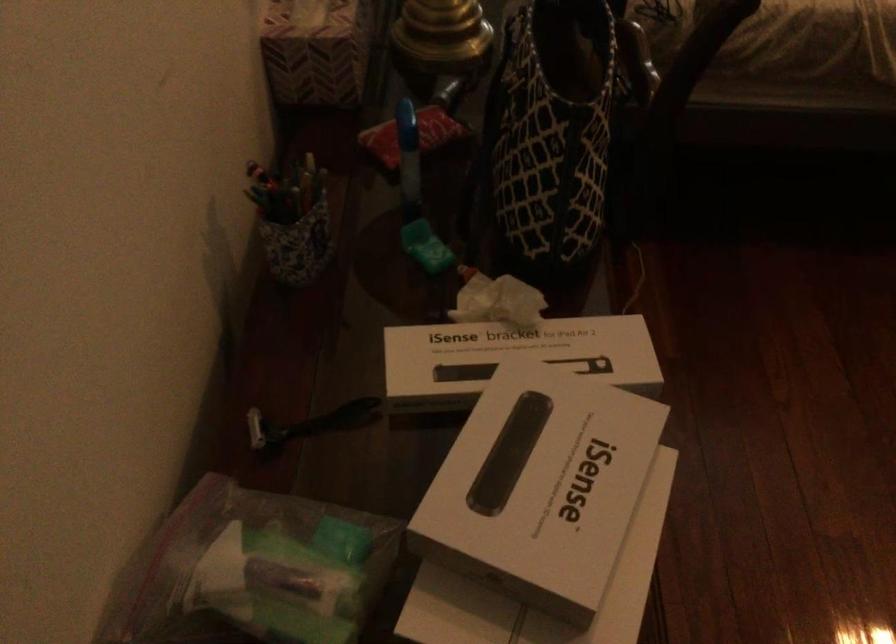
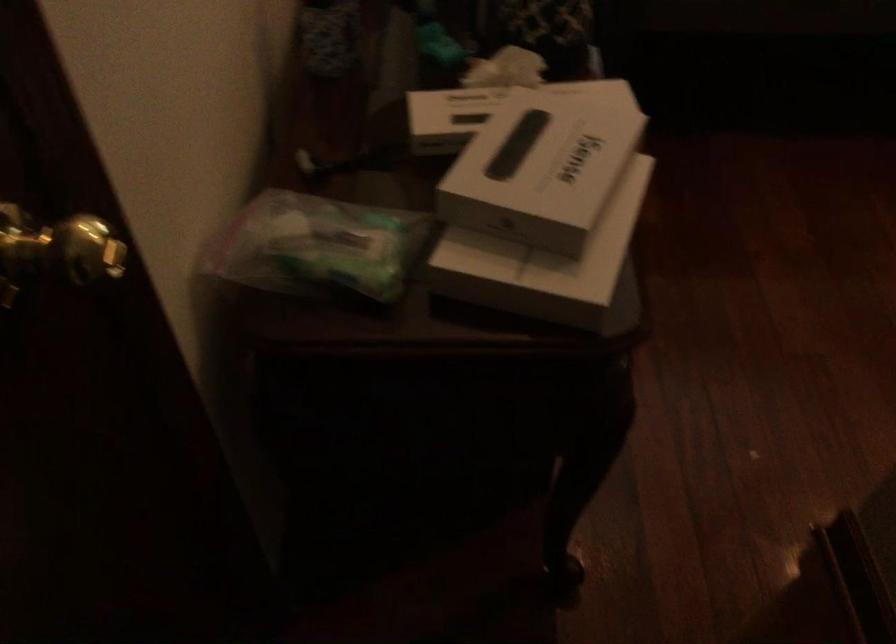
Question: How did the camera likely rotate?

Choices:
 (A) Left
 (B) Right
 (C) Up
 (D) Down

Answer: (C)